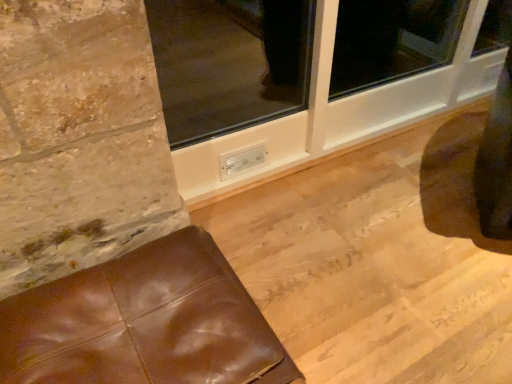
Question: From the image's perspective, would you say white plastic window frame at lower center is shown under brown leather ottoman at lower left?

Choices:
 (A) yes
 (B) no

Answer: (B)

Question: From the image's perspective, would you say white plastic window frame at lower center is positioned over brown leather ottoman at lower left?

Choices:
 (A) no
 (B) yes

Answer: (B)

Question: Is white plastic window frame at lower center closer to the viewer compared to brown leather ottoman at lower left?

Choices:
 (A) no
 (B) yes

Answer: (A)

Question: Is white plastic window frame at lower center to the left of brown leather ottoman at lower left from the viewer's perspective?

Choices:
 (A) no
 (B) yes

Answer: (A)

Question: Can you confirm if white plastic window frame at lower center is wider than brown leather ottoman at lower left?

Choices:
 (A) yes
 (B) no

Answer: (B)

Question: Is the surface of white plastic window frame at lower center in direct contact with brown leather ottoman at lower left?

Choices:
 (A) no
 (B) yes

Answer: (A)

Question: Can you confirm if brown leather ottoman at lower left is smaller than white plastic window frame at lower center?

Choices:
 (A) yes
 (B) no

Answer: (A)

Question: From the image's perspective, does brown leather ottoman at lower left appear higher than white plastic window frame at lower center?

Choices:
 (A) no
 (B) yes

Answer: (A)

Question: Is brown leather ottoman at lower left bigger than white plastic window frame at lower center?

Choices:
 (A) yes
 (B) no

Answer: (B)

Question: Can you confirm if brown leather ottoman at lower left is positioned to the right of white plastic window frame at lower center?

Choices:
 (A) no
 (B) yes

Answer: (A)

Question: From a real-world perspective, is brown leather ottoman at lower left under white plastic window frame at lower center?

Choices:
 (A) yes
 (B) no

Answer: (A)

Question: Is brown leather ottoman at lower left thinner than white plastic window frame at lower center?

Choices:
 (A) yes
 (B) no

Answer: (B)

Question: Visually, is white plastic window frame at lower center positioned to the left or to the right of brown leather ottoman at lower left?

Choices:
 (A) right
 (B) left

Answer: (A)